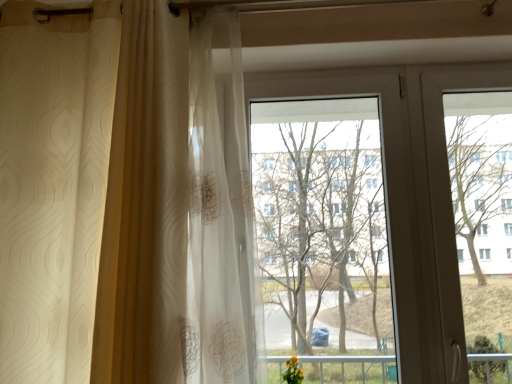
Question: From a real-world perspective, is white sheer curtain at left located beneath transparent plastic screen door at right?

Choices:
 (A) yes
 (B) no

Answer: (B)

Question: Considering the relative sizes of white sheer curtain at left and transparent plastic screen door at right in the image provided, is white sheer curtain at left smaller than transparent plastic screen door at right?

Choices:
 (A) no
 (B) yes

Answer: (A)

Question: From a real-world perspective, is white sheer curtain at left physically above transparent plastic screen door at right?

Choices:
 (A) no
 (B) yes

Answer: (B)

Question: From the image's perspective, is white sheer curtain at left above transparent plastic screen door at right?

Choices:
 (A) no
 (B) yes

Answer: (B)

Question: Can you confirm if white sheer curtain at left is taller than transparent plastic screen door at right?

Choices:
 (A) yes
 (B) no

Answer: (A)

Question: Can you confirm if white sheer curtain at left is shorter than transparent plastic screen door at right?

Choices:
 (A) yes
 (B) no

Answer: (B)

Question: Is transparent plastic screen door at right positioned before white sheer curtain at left?

Choices:
 (A) yes
 (B) no

Answer: (B)

Question: Considering the relative sizes of transparent plastic screen door at right and white sheer curtain at left in the image provided, is transparent plastic screen door at right shorter than white sheer curtain at left?

Choices:
 (A) yes
 (B) no

Answer: (A)

Question: Is transparent plastic screen door at right looking in the opposite direction of white sheer curtain at left?

Choices:
 (A) no
 (B) yes

Answer: (A)

Question: Does transparent plastic screen door at right appear on the right side of white sheer curtain at left?

Choices:
 (A) yes
 (B) no

Answer: (A)

Question: Does transparent plastic screen door at right appear on the left side of white sheer curtain at left?

Choices:
 (A) yes
 (B) no

Answer: (B)

Question: Can you confirm if transparent plastic screen door at right is taller than white sheer curtain at left?

Choices:
 (A) no
 (B) yes

Answer: (A)

Question: Is transparent glass window at center facing towards transparent plastic screen door at right?

Choices:
 (A) yes
 (B) no

Answer: (B)